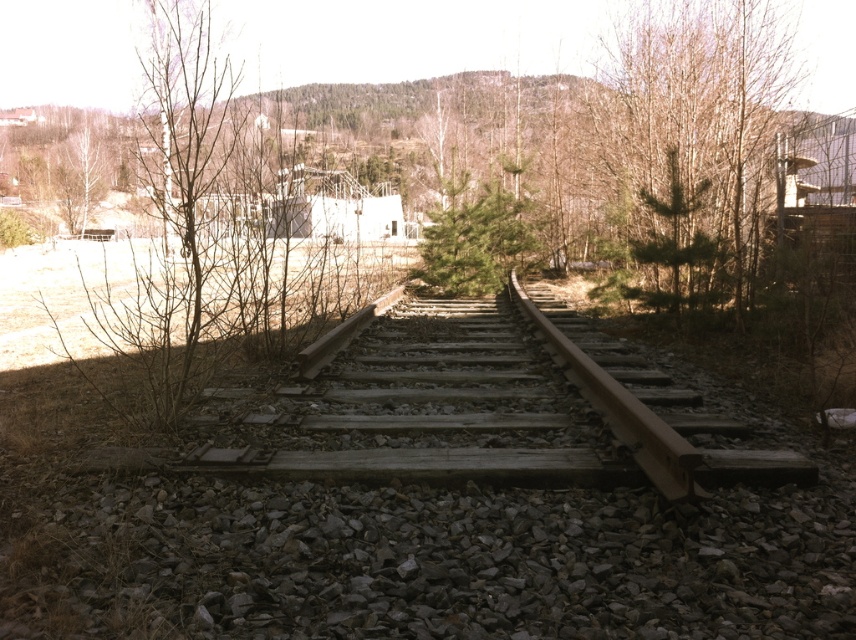
Looking at this image, is brown wooden train track at center positioned before bare branches at left?

Yes, brown wooden train track at center is closer to the viewer.

Is point (235, 436) positioned before point (272, 285)?

Yes, it is.

Locate an element on the screen. The width and height of the screenshot is (856, 640). brown wooden train track at center is located at coordinates (468, 404).

Consider the image. Can you confirm if bare branches at left is positioned to the left of green leafy tree at upper right?

Indeed, bare branches at left is positioned on the left side of green leafy tree at upper right.

Which is in front, point (188, 372) or point (648, 189)?

Positioned in front is point (188, 372).

Locate an element on the screen. bare branches at left is located at coordinates (206, 236).

Is brown wooden train track at center to the left of green leafy tree at upper right from the viewer's perspective?

Yes, brown wooden train track at center is to the left of green leafy tree at upper right.

Consider the image. Can you confirm if brown wooden train track at center is thinner than green leafy tree at upper right?

In fact, brown wooden train track at center might be wider than green leafy tree at upper right.

Is point (388, 451) less distant than point (651, 93)?

Yes.

Identify the location of brown wooden train track at center. The width and height of the screenshot is (856, 640). (468, 404).